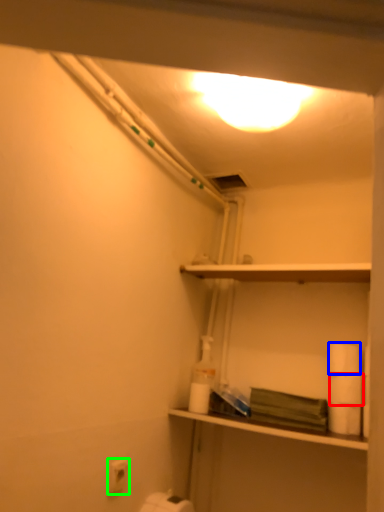
Question: Which object is positioned farthest from toilet paper (highlighted by a red box)? Select from toilet paper (highlighted by a blue box) and toilet paper (highlighted by a green box).

Choices:
 (A) toilet paper
 (B) toilet paper

Answer: (B)